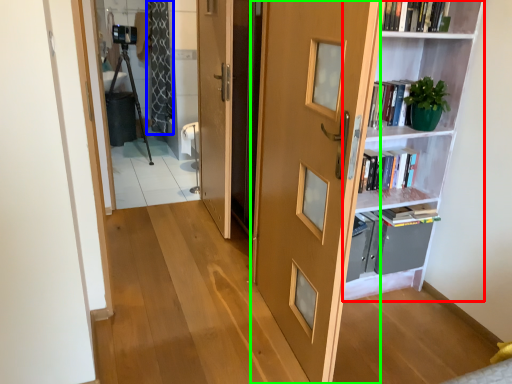
Question: Estimate the real-world distances between objects in this image. Which object is closer to shelf (highlighted by a red box), curtain (highlighted by a blue box) or door (highlighted by a green box)?

Choices:
 (A) curtain
 (B) door

Answer: (B)